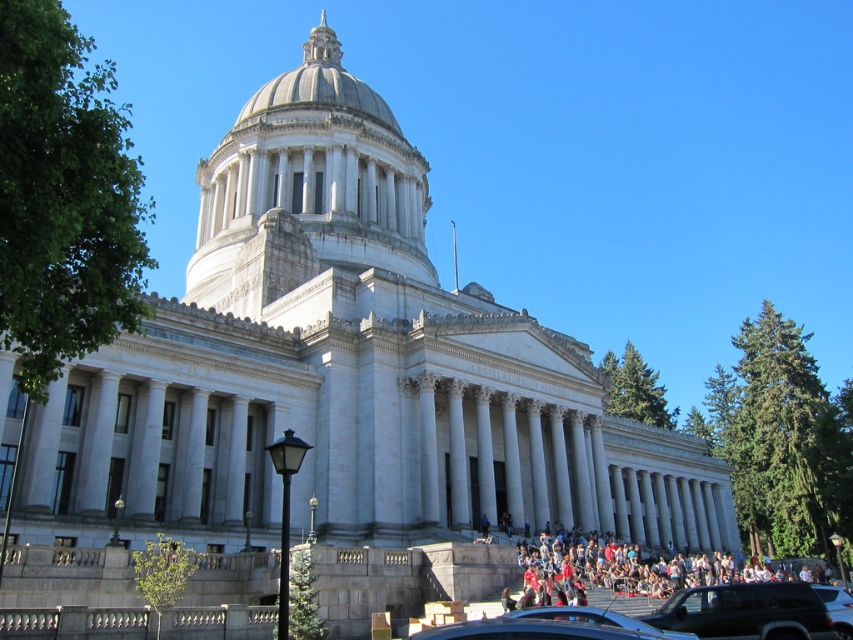
Question: Which of the following is the closest to the observer?

Choices:
 (A) white marble dome at center
 (B) green coniferous tree at right

Answer: (A)

Question: Can you confirm if white marble dome at center is positioned above green leafy tree at center-right?

Choices:
 (A) yes
 (B) no

Answer: (A)

Question: Estimate the real-world distances between objects in this image. Which object is closer to the green leafy tree at lower left?

Choices:
 (A) green coniferous tree at right
 (B) green leafy tree at left

Answer: (B)

Question: Is green coniferous tree at right above metallic silver car at lower right?

Choices:
 (A) no
 (B) yes

Answer: (A)

Question: Estimate the real-world distances between objects in this image. Which object is closer to the metallic silver car at lower right?

Choices:
 (A) green leafy tree at lower left
 (B) white marble dome at center
 (C) green leafy tree at center-right

Answer: (A)

Question: Does green coniferous tree at right appear on the left side of matte black crowd at lower center?

Choices:
 (A) no
 (B) yes

Answer: (A)